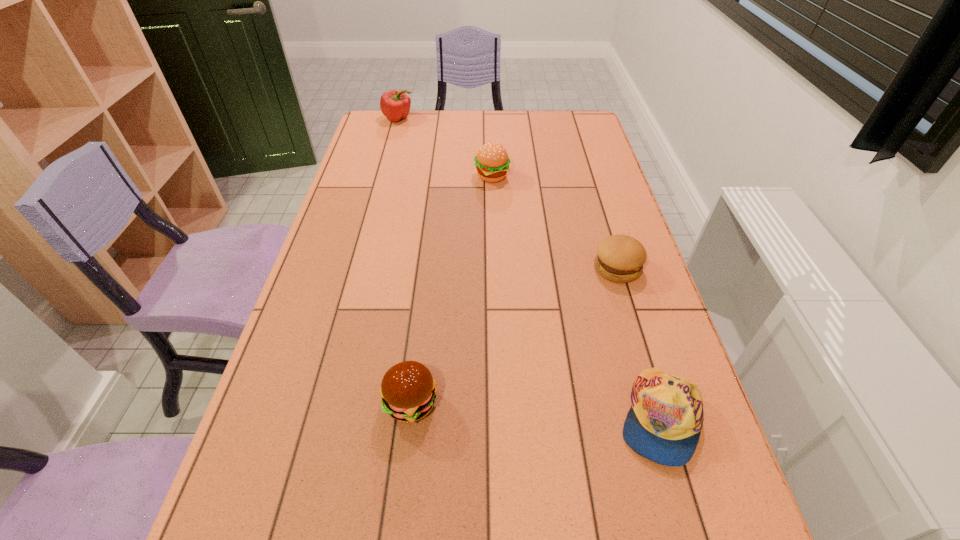
Image resolution: width=960 pixels, height=540 pixels. Find the location of `free spot between the bell pepper and the second farthest hamburger`. free spot between the bell pepper and the second farthest hamburger is located at coordinates (508, 193).

The image size is (960, 540). I want to click on vacant space that is in between the cap and the leftmost hamburger, so tap(535, 410).

Identify the location of object that ranks as the fourth closest to the rightmost hamburger. The width and height of the screenshot is (960, 540). (395, 105).

This screenshot has height=540, width=960. What are the coordinates of `object that is the nearest to the second farthest hamburger` in the screenshot? It's located at (664, 423).

Identify the location of hamburger that is the second closest to the third nearest object. This screenshot has width=960, height=540. (408, 390).

Select which hamburger appears as the second closest to the fourth nearest object. Please provide its 2D coordinates. Your answer should be formatted as a tuple, i.e. [(x, y)], where the tuple contains the x and y coordinates of a point satisfying the conditions above.

[(408, 390)]